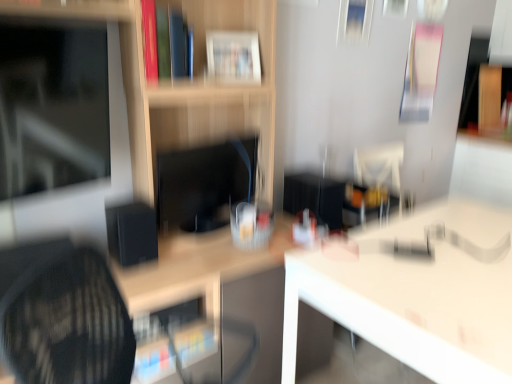
Question: Is matte black monitor at center, arranged as the 2th computer monitor when viewed from the front, looking in the opposite direction of white glossy table at center, which appears as the second table when viewed from the left?

Choices:
 (A) yes
 (B) no

Answer: (B)

Question: Considering the relative positions of matte black monitor at center, arranged as the 2th computer monitor when viewed from the front, and white glossy table at center, which appears as the second table when viewed from the left, in the image provided, is matte black monitor at center, arranged as the 2th computer monitor when viewed from the front, to the right of white glossy table at center, which appears as the second table when viewed from the left, from the viewer's perspective?

Choices:
 (A) yes
 (B) no

Answer: (B)

Question: Does matte black monitor at center, the 1th computer monitor when ordered from right to left, have a greater height compared to white glossy table at center, the first table from the right?

Choices:
 (A) yes
 (B) no

Answer: (B)

Question: Is matte black monitor at center, arranged as the 2th computer monitor when viewed from the front, oriented towards white glossy table at center, which appears as the second table when viewed from the left?

Choices:
 (A) no
 (B) yes

Answer: (A)

Question: Is matte black monitor at center, the 1th computer monitor when ordered from right to left, positioned far away from white glossy table at center, the first table from the right?

Choices:
 (A) yes
 (B) no

Answer: (B)

Question: Does matte black monitor at center, arranged as the 2th computer monitor when viewed from the front, have a larger size compared to white glossy table at center, the first table from the right?

Choices:
 (A) no
 (B) yes

Answer: (A)

Question: Could white glossy table at center, the 2th table in the right-to-left sequence, be considered to be inside matte black monitor at left, the 1th computer monitor from the front?

Choices:
 (A) yes
 (B) no

Answer: (B)

Question: Is matte black monitor at left, the 1th computer monitor from the front, shorter than white glossy table at center, placed as the first table when sorted from left to right?

Choices:
 (A) no
 (B) yes

Answer: (B)

Question: Is the position of matte black monitor at left, arranged as the 1th computer monitor when viewed from the left, more distant than that of white glossy table at center, placed as the first table when sorted from left to right?

Choices:
 (A) yes
 (B) no

Answer: (A)

Question: Is matte black monitor at left, the 1th computer monitor from the front, facing away from white glossy table at center, placed as the first table when sorted from left to right?

Choices:
 (A) yes
 (B) no

Answer: (B)

Question: Is matte black monitor at left, arranged as the 1th computer monitor when viewed from the left, to the right of white glossy table at center, placed as the first table when sorted from left to right, from the viewer's perspective?

Choices:
 (A) yes
 (B) no

Answer: (B)

Question: Is matte black monitor at left, the 1th computer monitor from the front, smaller than white glossy table at center, placed as the first table when sorted from left to right?

Choices:
 (A) yes
 (B) no

Answer: (A)

Question: From a real-world perspective, is wooden shelf at center under white glossy table at center, which appears as the second table when viewed from the left?

Choices:
 (A) no
 (B) yes

Answer: (A)